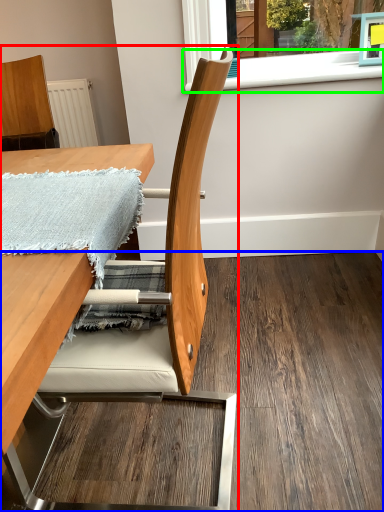
Question: Based on their relative distances, which object is farther from chair (highlighted by a red box)? Choose from plywood (highlighted by a blue box) and window sill (highlighted by a green box).

Choices:
 (A) plywood
 (B) window sill

Answer: (B)